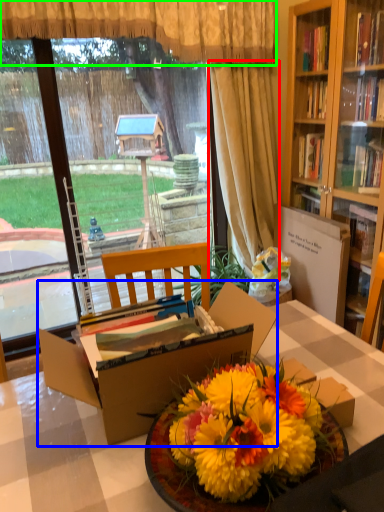
Question: Estimate the real-world distances between objects in this image. Which object is farther from curtain (highlighted by a red box), box (highlighted by a blue box) or curtain (highlighted by a green box)?

Choices:
 (A) box
 (B) curtain

Answer: (A)